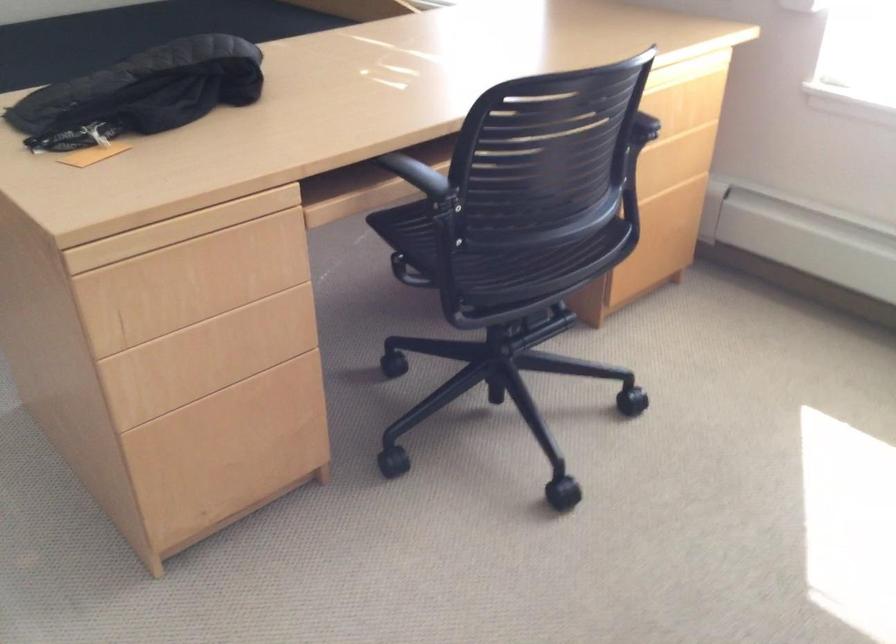
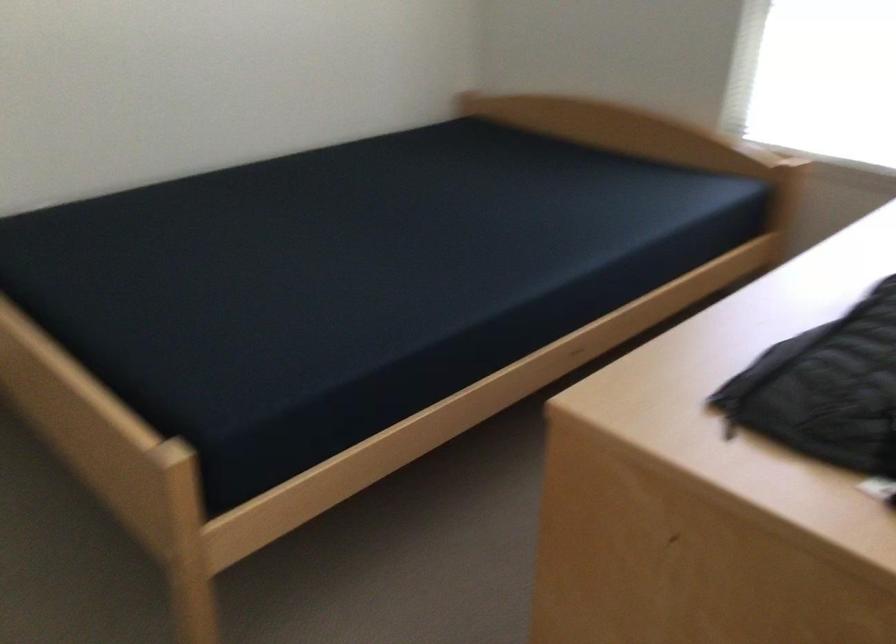
What movement of the cameraman would produce the second image?

The cameraman moved toward left, forward.